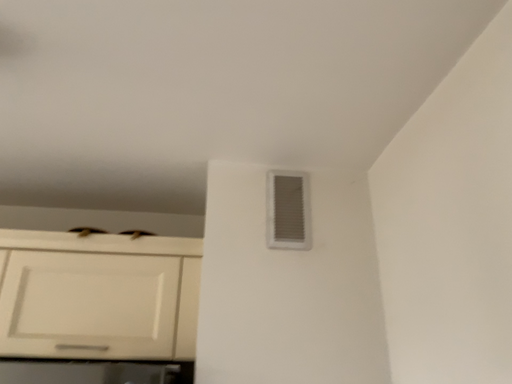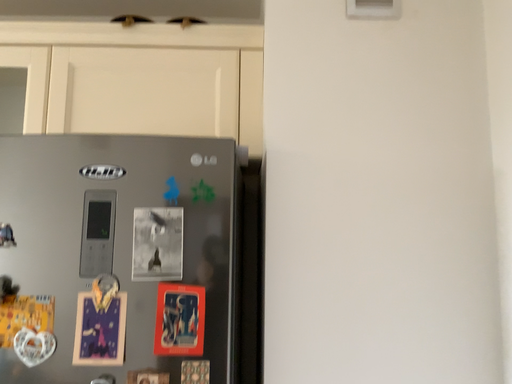
Question: Which way did the camera rotate in the video?

Choices:
 (A) rotated upward
 (B) rotated downward

Answer: (B)